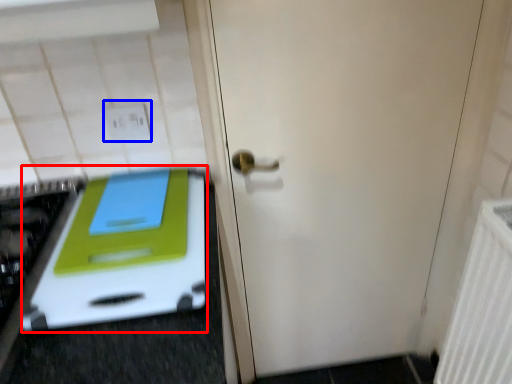
Question: Which of the following is the closest to the observer, oven (highlighted by a red box) or electric outlet (highlighted by a blue box)?

Choices:
 (A) oven
 (B) electric outlet

Answer: (A)